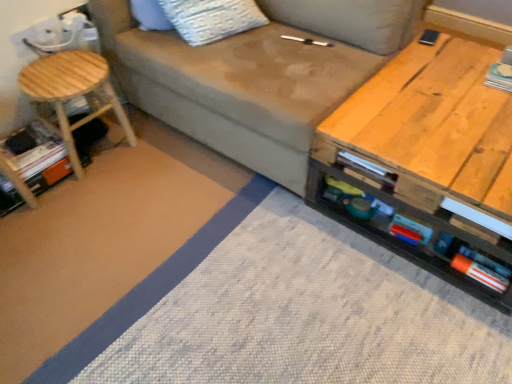
Question: Should I look upward or downward to see natural wood stool at left?

Choices:
 (A) up
 (B) down

Answer: (A)

Question: From a real-world perspective, is matte gray fabric couch at center located beneath white paper book at upper right, which is counted as the 1th book, starting from the right?

Choices:
 (A) no
 (B) yes

Answer: (A)

Question: Is matte gray fabric couch at center oriented away from white paper book at upper right, positioned as the 2th book in bottom-to-top order?

Choices:
 (A) yes
 (B) no

Answer: (B)

Question: Is matte gray fabric couch at center placed right next to white paper book at upper right, positioned as the 2th book in bottom-to-top order?

Choices:
 (A) no
 (B) yes

Answer: (A)

Question: Does matte gray fabric couch at center turn towards white paper book at upper right, which is counted as the 1th book, starting from the right?

Choices:
 (A) yes
 (B) no

Answer: (B)

Question: Is matte gray fabric couch at center closer to camera compared to white paper book at upper right, the 2th book positioned from the left?

Choices:
 (A) no
 (B) yes

Answer: (B)

Question: Is white paper book at upper right, acting as the 1th book starting from the top, inside matte gray fabric couch at center?

Choices:
 (A) yes
 (B) no

Answer: (B)

Question: From the image's perspective, is matte gray fabric couch at center on top of natural wood stool at left?

Choices:
 (A) yes
 (B) no

Answer: (A)

Question: Considering the relative positions of matte gray fabric couch at center and natural wood stool at left in the image provided, is matte gray fabric couch at center to the right of natural wood stool at left from the viewer's perspective?

Choices:
 (A) yes
 (B) no

Answer: (A)

Question: Is the depth of matte gray fabric couch at center less than that of natural wood stool at left?

Choices:
 (A) yes
 (B) no

Answer: (A)

Question: Is matte gray fabric couch at center outside of natural wood stool at left?

Choices:
 (A) no
 (B) yes

Answer: (B)

Question: From a real-world perspective, is matte gray fabric couch at center physically below natural wood stool at left?

Choices:
 (A) no
 (B) yes

Answer: (A)

Question: Is matte gray fabric couch at center oriented towards natural wood stool at left?

Choices:
 (A) no
 (B) yes

Answer: (B)

Question: Could you tell me if wooden table at right is facing white paper book at upper right, positioned as the 2th book in bottom-to-top order?

Choices:
 (A) no
 (B) yes

Answer: (A)